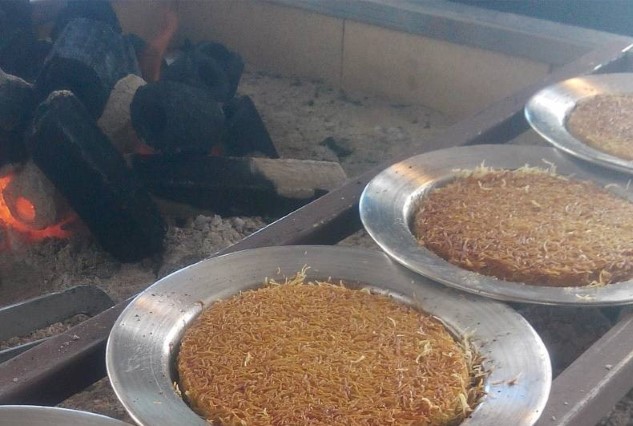
Locate an element on the screen. ground of fireplace is located at coordinates coord(353,131).